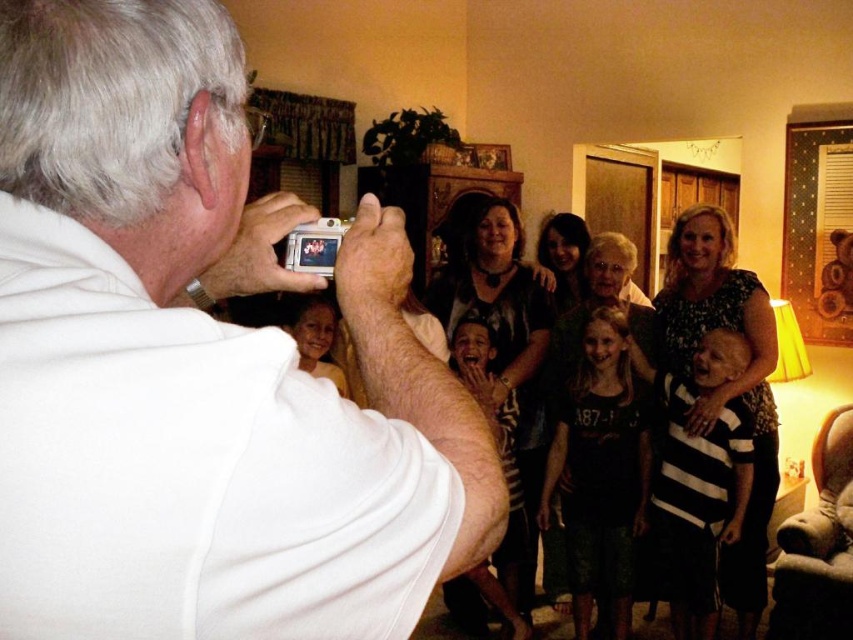
Question: Does dark gray striped dress at center have a larger size compared to striped fabric baby at center?

Choices:
 (A) yes
 (B) no

Answer: (A)

Question: Which point is closer to the camera?

Choices:
 (A) white matte camera at upper center
 (B) dark gray shirt at center
 (C) striped fabric baby at center
 (D) matte black dress at center

Answer: (A)

Question: Is striped fabric baby at center to the left of matte black dress at center from the viewer's perspective?

Choices:
 (A) yes
 (B) no

Answer: (B)

Question: Is striped fabric baby at center wider than matte black dress at center?

Choices:
 (A) no
 (B) yes

Answer: (A)

Question: Which object appears closest to the camera in this image?

Choices:
 (A) dark gray shirt at center
 (B) striped fabric baby at center

Answer: (B)

Question: Which of these objects is positioned farthest from the dark gray shirt at center?

Choices:
 (A) white matte camera at upper center
 (B) dark gray striped dress at center
 (C) striped fabric baby at center
 (D) matte black dress at center

Answer: (A)